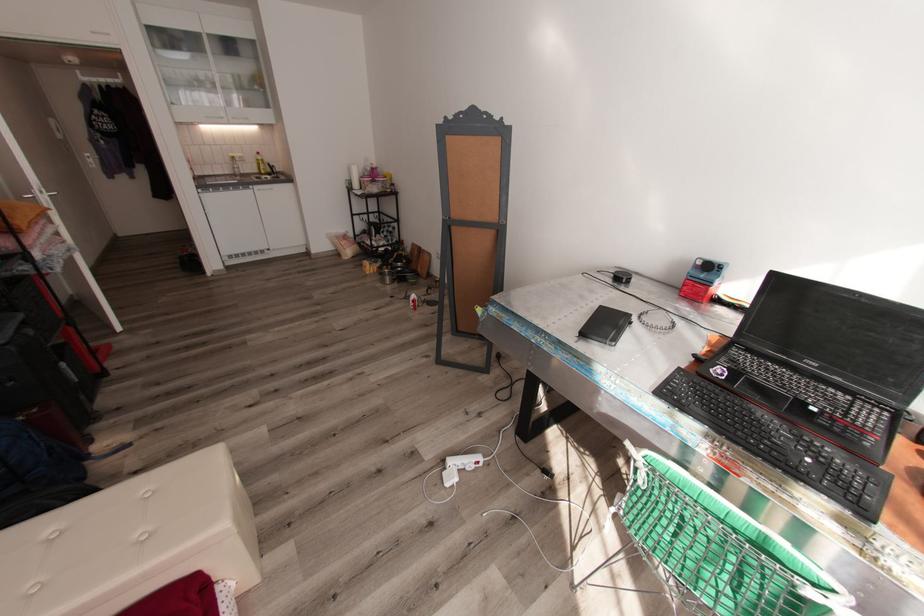
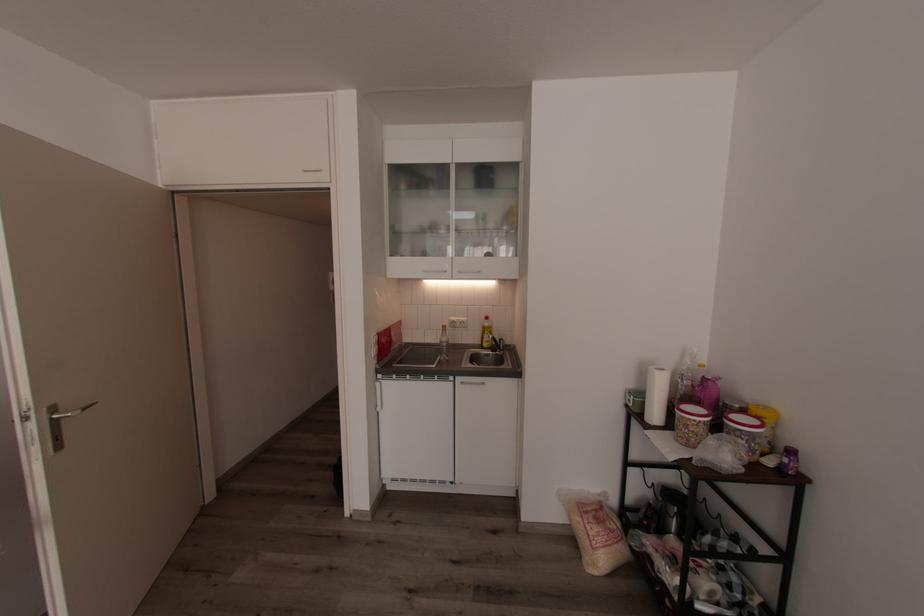
Where in the second image is the point corresponding to point (198, 124) from the first image?

(423, 280)